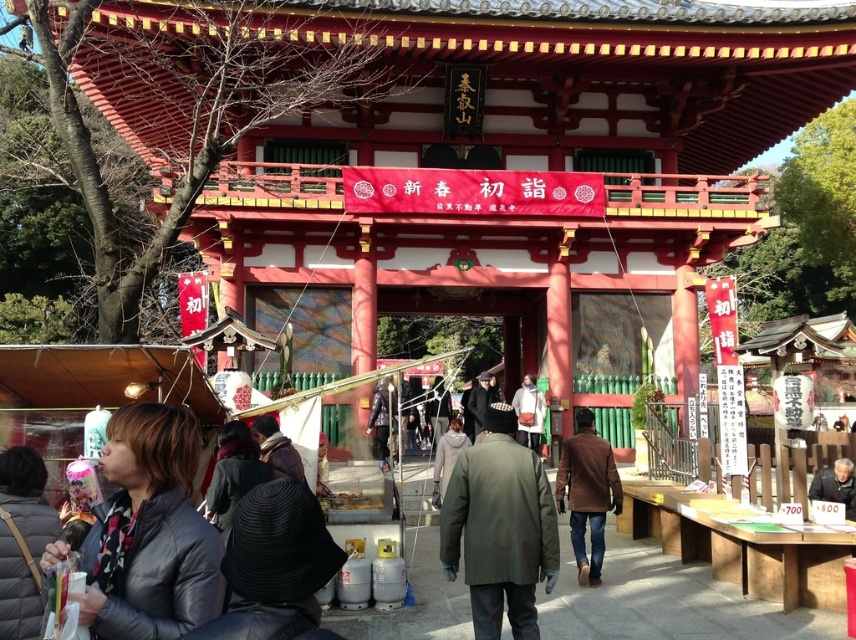
You are a visitor at the shrine and want to place a gift into the white fabric bag at center. However, you need to first put your offering on the light brown wooden table at lower right. Based on their positions, can you reach the table before the bag?

The light brown wooden table at lower right is in front of the white fabric bag at center, so you can reach the table before the bag.

Looking at this image, you are standing at the entrance of the shrine and want to take a photo of both the point at coordinates point (x=474, y=589) and point (x=578, y=417) in the scene. Since you can only focus on one point at a time, which point should you focus on first to ensure the other point remains in the background?

You should focus on point (x=474, y=589) first because it is in front of point (x=578, y=417), so the latter will naturally be in the background when the former is in focus.